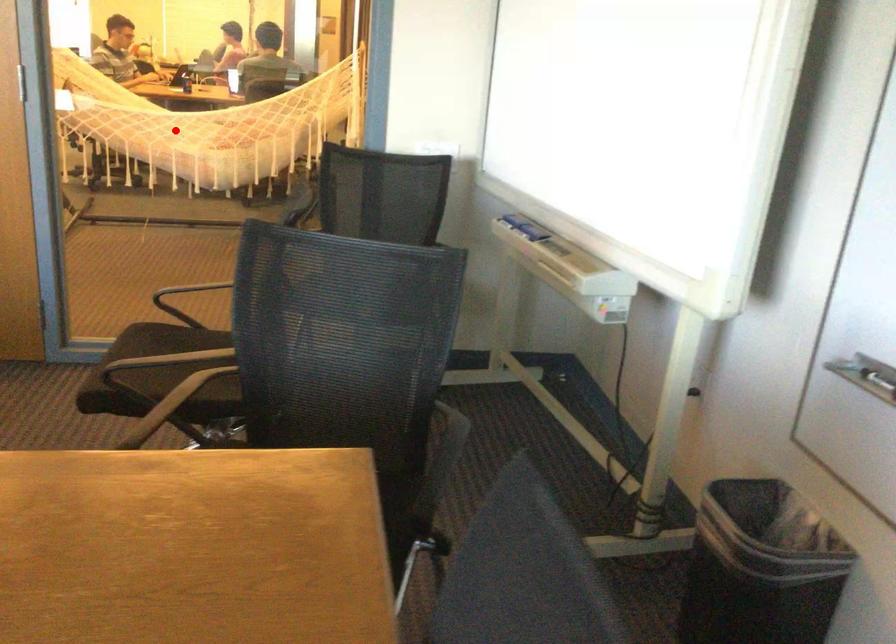
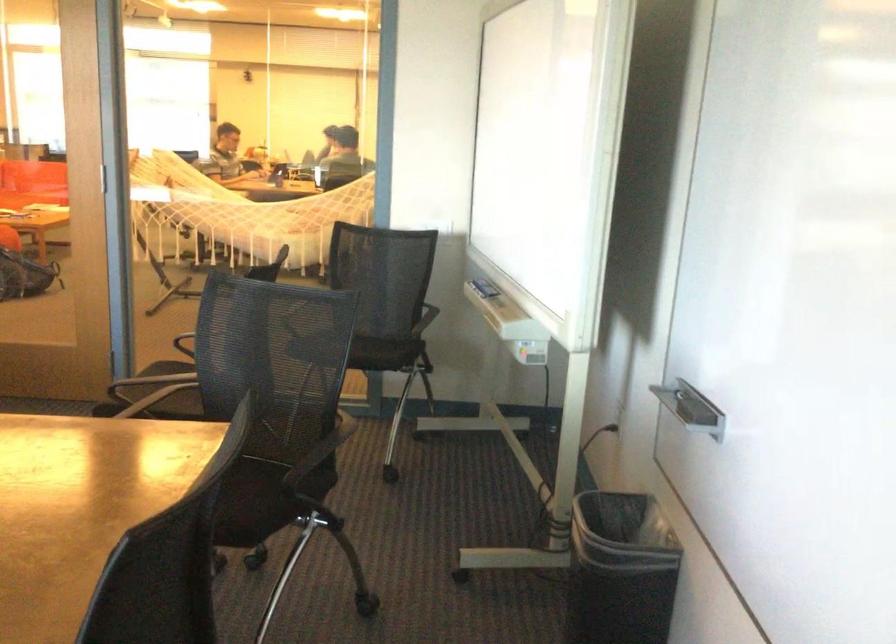
The point at the highlighted location is marked in the first image. Where is the corresponding point in the second image?

(246, 213)